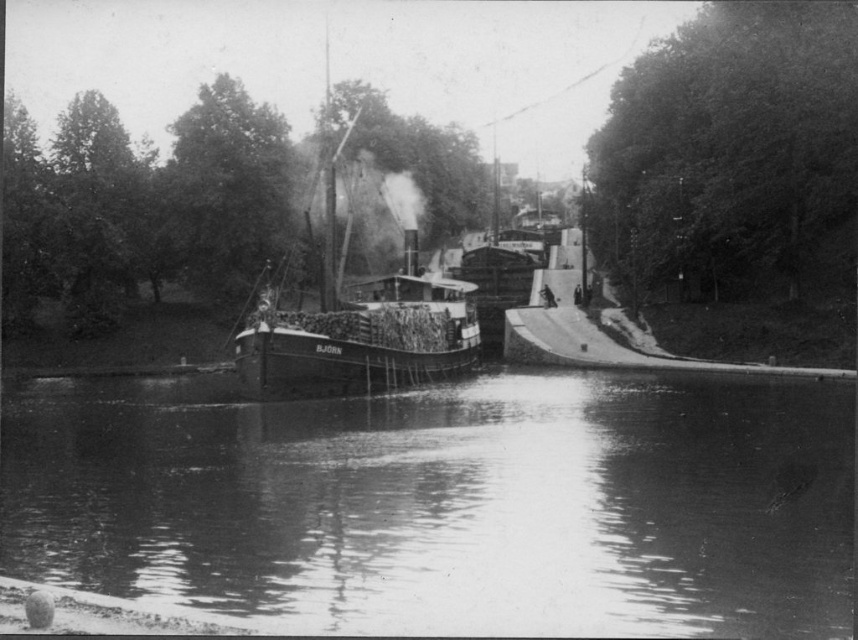
Question: Which of the following is the closest to the observer?

Choices:
 (A) (343, 253)
 (B) (744, 528)

Answer: (B)

Question: Does smooth water at center appear over wooden steamboat at center?

Choices:
 (A) yes
 (B) no

Answer: (B)

Question: Among these objects, which one is nearest to the camera?

Choices:
 (A) smooth water at center
 (B) wooden steamboat at center

Answer: (A)

Question: Is smooth water at center above wooden steamboat at center?

Choices:
 (A) yes
 (B) no

Answer: (B)

Question: Does smooth water at center come in front of wooden steamboat at center?

Choices:
 (A) no
 (B) yes

Answer: (B)

Question: Which of the following is the farthest from the observer?

Choices:
 (A) (403, 381)
 (B) (639, 380)

Answer: (B)